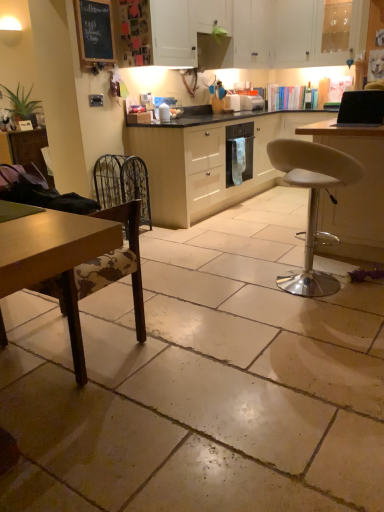
Where is `black chalkboard at upper left`? This screenshot has width=384, height=512. black chalkboard at upper left is located at coordinates (94, 32).

Where is `black glossy laptop at upper right`? The width and height of the screenshot is (384, 512). black glossy laptop at upper right is located at coordinates (361, 108).

This screenshot has width=384, height=512. Describe the element at coordinates (122, 183) in the screenshot. I see `metallic wire swivel chair at left` at that location.

Measure the distance between point (230,102) and camera.

Point (230,102) and camera are 14.33 feet apart from each other.

Identify the location of black chalkboard at upper left. (94, 32).

Which object is closer to the camera, metallic oven at center, the second appliance from the front, or wooden chair at lower left, placed as the second chair when sorted from right to left?

Positioned in front is wooden chair at lower left, placed as the second chair when sorted from right to left.

Is point (254, 101) positioned before point (102, 227)?

No, it is behind (102, 227).

Considering the sizes of metallic oven at center, arranged as the 1th appliance when viewed from the back, and wooden chair at lower left, placed as the second chair when sorted from right to left, in the image, is metallic oven at center, arranged as the 1th appliance when viewed from the back, taller or shorter than wooden chair at lower left, placed as the second chair when sorted from right to left,?

Considering their sizes, metallic oven at center, arranged as the 1th appliance when viewed from the back, has less height than wooden chair at lower left, placed as the second chair when sorted from right to left.

Is metallic oven at center, arranged as the 1th appliance when viewed from the back, thinner than wooden chair at lower left, which is counted as the 1th chair, starting from the left?

Correct, the width of metallic oven at center, arranged as the 1th appliance when viewed from the back, is less than that of wooden chair at lower left, which is counted as the 1th chair, starting from the left.

Which object is positioned more to the right, black glossy laptop at upper right or metallic wire swivel chair at left?

From the viewer's perspective, black glossy laptop at upper right appears more on the right side.

Which is farther, (351,103) or (125,183)?

The point (125,183) is farther.

From a real-world perspective, between black glossy laptop at upper right and metallic wire swivel chair at left, who is vertically lower?

metallic wire swivel chair at left, from a real-world perspective.

From the image's perspective, between black glossy laptop at upper right and metallic oven at center, the second appliance from the front, which one is located above?

metallic oven at center, the second appliance from the front.

Does black glossy laptop at upper right turn towards metallic oven at center, the second appliance from the front?

No.

How far apart are black glossy laptop at upper right and metallic oven at center, arranged as the 1th appliance when viewed from the back?

They are 5.87 feet apart.

Between point (356, 123) and point (254, 105), which one is positioned in front?

The point (356, 123) is closer to the camera.

Which object is wider, metallic wire swivel chair at left or black chalkboard at upper left?

With larger width is metallic wire swivel chair at left.

Which object is positioned more to the left, metallic wire swivel chair at left or black chalkboard at upper left?

Positioned to the left is black chalkboard at upper left.

Which is correct: metallic wire swivel chair at left is inside black chalkboard at upper left, or outside of it?

The correct answer is: outside.

Considering the relative sizes of metallic wire swivel chair at left and black chalkboard at upper left in the image provided, is metallic wire swivel chair at left shorter than black chalkboard at upper left?

No.

In the scene shown: Is the surface of metallic oven at center, the second appliance from the front, in direct contact with white glossy cabinet at upper center, which ranks as the 1th cabinetry in top-to-bottom order?

No.

Considering the sizes of objects metallic oven at center, arranged as the 1th appliance when viewed from the back, and white glossy cabinet at upper center, which ranks as the 1th cabinetry in top-to-bottom order, in the image provided, who is bigger, metallic oven at center, arranged as the 1th appliance when viewed from the back, or white glossy cabinet at upper center, which ranks as the 1th cabinetry in top-to-bottom order,?

With larger size is white glossy cabinet at upper center, which ranks as the 1th cabinetry in top-to-bottom order.

Would you say metallic oven at center, the second appliance from the front, is inside or outside white glossy cabinet at upper center, the 3th cabinetry ordered from the bottom?

metallic oven at center, the second appliance from the front, is spatially situated outside white glossy cabinet at upper center, the 3th cabinetry ordered from the bottom.

You are a GUI agent. You are given a task and a screenshot of the screen. Output one action in this format:
    pyautogui.click(x=<x>, y=<y>)
    Task: Click on the 1st appliance counting from the left of the white glossy cabinet at upper center, which ranks as the 1th cabinetry in top-to-bottom order
    
    Given the screenshot: What is the action you would take?
    coord(251,102)

Is metallic oven at center, arranged as the 1th appliance when viewed from the back, aimed at black chalkboard at upper left?

No, metallic oven at center, arranged as the 1th appliance when viewed from the back, is not aimed at black chalkboard at upper left.

Is metallic oven at center, arranged as the 1th appliance when viewed from the back, located outside black chalkboard at upper left?

Yes, metallic oven at center, arranged as the 1th appliance when viewed from the back, is not within black chalkboard at upper left.

Is metallic oven at center, the second appliance from the front, next to black chalkboard at upper left?

metallic oven at center, the second appliance from the front, is not next to black chalkboard at upper left, and they're not touching.

From a real-world perspective, between metallic oven at center, the second appliance from the front, and black chalkboard at upper left, who is vertically higher?

In real-world perspective, black chalkboard at upper left is above.

Is black chalkboard at upper left facing away from black glossy laptop at upper right?

No.

From their relative heights in the image, would you say black chalkboard at upper left is taller or shorter than black glossy laptop at upper right?

Clearly, black chalkboard at upper left is taller compared to black glossy laptop at upper right.

Is black chalkboard at upper left completely or partially outside of black glossy laptop at upper right?

Yes, black chalkboard at upper left is located beyond the bounds of black glossy laptop at upper right.

Is the depth of black chalkboard at upper left less than that of black glossy laptop at upper right?

That is False.

Starting from the wooden chair at lower left, placed as the second chair when sorted from right to left, which appliance is the 2nd one behind? Please provide its 2D coordinates.

[(251, 102)]

Find the location of `laptop above the metallic wire swivel chair at left (from a real-world perspective)`. laptop above the metallic wire swivel chair at left (from a real-world perspective) is located at coordinates (361, 108).

Considering their positions, is black chalkboard at upper left positioned further to white glossy cabinet at upper center, the 3th cabinetry ordered from the bottom, than white matte cabinet at upper center, placed as the second cabinetry when sorted from bottom to top?

black chalkboard at upper left.

Estimate the real-world distances between objects in this image. Which object is further from metallic wire swivel chair at left, white plastic toaster at center, the 2th appliance from the back, or cream matte cabinet at center, placed as the first cabinetry when sorted from bottom to top?

white plastic toaster at center, the 2th appliance from the back, is further to metallic wire swivel chair at left.

From the image, which object appears to be farther from white plastic toaster at center, the 1th appliance in the front-to-back sequence, black chalkboard at upper left or white plastic table at right?

Based on the image, white plastic table at right appears to be further to white plastic toaster at center, the 1th appliance in the front-to-back sequence.

Estimate the real-world distances between objects in this image. Which object is closer to black glossy laptop at upper right, metallic oven at center, the second appliance from the front, or cream matte cabinet at center, placed as the first cabinetry when sorted from bottom to top?

Based on the image, cream matte cabinet at center, placed as the first cabinetry when sorted from bottom to top, appears to be nearer to black glossy laptop at upper right.

Based on the photo, which object lies further to the anchor point white glossy cabinet at upper center, the 3th cabinetry ordered from the bottom, wooden chair at lower left, placed as the second chair when sorted from right to left, or white matte cabinet at upper center, placed as the second cabinetry when sorted from bottom to top?

Among the two, wooden chair at lower left, placed as the second chair when sorted from right to left, is located further to white glossy cabinet at upper center, the 3th cabinetry ordered from the bottom.

Based on their spatial positions, is cream matte cabinet at center, placed as the first cabinetry when sorted from bottom to top, or white matte cabinet at upper center, placed as the second cabinetry when sorted from bottom to top, closer to white glossy cabinet at upper center, which ranks as the 1th cabinetry in top-to-bottom order?

Among the two, white matte cabinet at upper center, placed as the second cabinetry when sorted from bottom to top, is located nearer to white glossy cabinet at upper center, which ranks as the 1th cabinetry in top-to-bottom order.

When comparing their distances from white leather stool at center-right, which is the first chair from right to left, does black chalkboard at upper left or black glossy laptop at upper right seem further?

black chalkboard at upper left is positioned further to the anchor white leather stool at center-right, which is the first chair from right to left.

Considering their positions, is white matte cabinet at upper center, placed as the second cabinetry when sorted from bottom to top, positioned further to metallic wire swivel chair at left than white plastic table at right?

Among the two, white matte cabinet at upper center, placed as the second cabinetry when sorted from bottom to top, is located further to metallic wire swivel chair at left.

Find the location of `laptop situated between metallic wire swivel chair at left and white plastic table at right from left to right`. laptop situated between metallic wire swivel chair at left and white plastic table at right from left to right is located at coordinates (361, 108).

You are a GUI agent. You are given a task and a screenshot of the screen. Output one action in this format:
    pyautogui.click(x=<x>, y=<y>)
    Task: Click on the bulletin board between wooden chair at lower left, placed as the second chair when sorted from right to left, and cream matte cabinet at center, acting as the 3th cabinetry starting from the top, in the front-back direction
    This screenshot has height=512, width=384.
    Given the screenshot: What is the action you would take?
    pyautogui.click(x=94, y=32)

The width and height of the screenshot is (384, 512). In order to click on chair located between wooden chair at lower left, which is counted as the 1th chair, starting from the left, and white glossy cabinet at upper center, the 3th cabinetry ordered from the bottom, in the depth direction in this screenshot , I will do `click(312, 203)`.

Where is `swivel chair positioned between wooden chair at lower left, which is counted as the 1th chair, starting from the left, and metallic oven at center, arranged as the 1th appliance when viewed from the back, from near to far`? This screenshot has height=512, width=384. swivel chair positioned between wooden chair at lower left, which is counted as the 1th chair, starting from the left, and metallic oven at center, arranged as the 1th appliance when viewed from the back, from near to far is located at coordinates (122, 183).